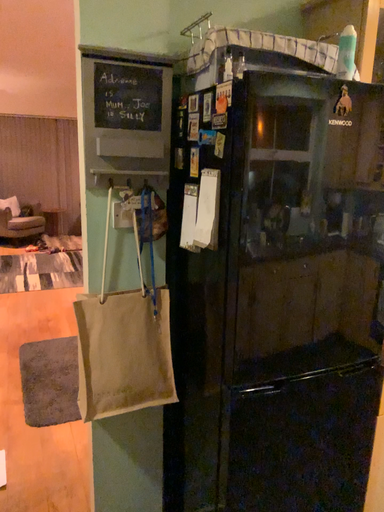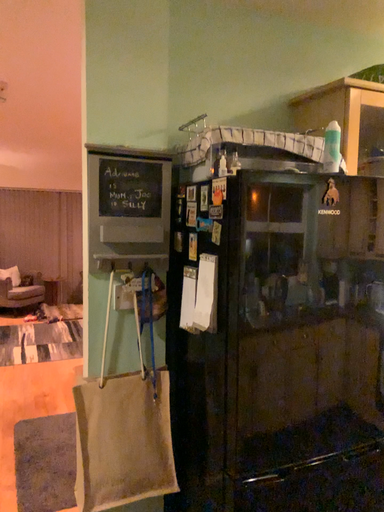
Question: How did the camera likely rotate when shooting the video?

Choices:
 (A) rotated upward
 (B) rotated downward

Answer: (A)